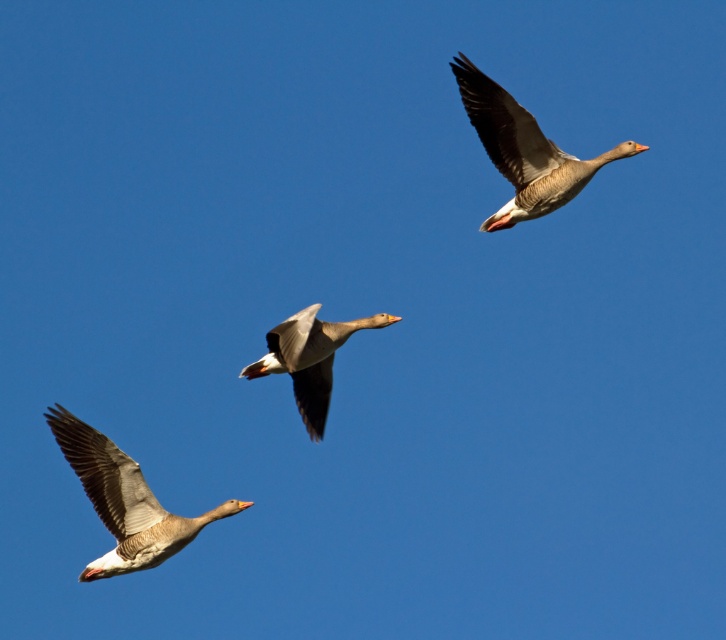
Question: Observing the image, what is the correct spatial positioning of gray matte goose at lower left in reference to gray matte goose at center?

Choices:
 (A) above
 (B) below

Answer: (B)

Question: Can you confirm if gray matte goose at upper right is positioned below gray matte goose at center?

Choices:
 (A) no
 (B) yes

Answer: (A)

Question: Does gray matte goose at lower left have a lesser width compared to gray matte goose at upper right?

Choices:
 (A) no
 (B) yes

Answer: (A)

Question: Among these objects, which one is farthest from the camera?

Choices:
 (A) gray matte goose at upper right
 (B) gray matte goose at lower left

Answer: (A)

Question: Which object appears farthest from the camera in this image?

Choices:
 (A) gray matte goose at upper right
 (B) gray matte goose at lower left

Answer: (A)

Question: Which of the following is the closest to the observer?

Choices:
 (A) (130, 560)
 (B) (322, 362)

Answer: (A)